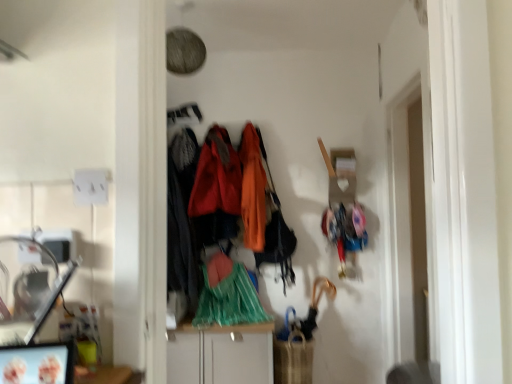
Question: Relative to white glossy cabinet at center, is velvet-like black coat at center, which appears as the first clothing when viewed from the left, in front or behind?

Choices:
 (A) behind
 (B) front

Answer: (A)

Question: Considering the relative positions of velvet-like black coat at center, which appears as the first clothing when viewed from the left, and white glossy cabinet at center in the image provided, is velvet-like black coat at center, which appears as the first clothing when viewed from the left, to the left or to the right of white glossy cabinet at center?

Choices:
 (A) right
 (B) left

Answer: (B)

Question: Which is farther from the orange fabric coat at center, acting as the first clothing starting from the right?

Choices:
 (A) velvet orange coat at center, which ranks as the 3th clothing in right-to-left order
 (B) white glossy cabinet at center
 (C) green plastic bag at center, the second clothing from the right
 (D) velvet-like black coat at center, which appears as the first clothing when viewed from the left

Answer: (B)

Question: Estimate the real-world distances between objects in this image. Which object is closer to the white glossy cabinet at center?

Choices:
 (A) velvet-like black coat at center, positioned as the fourth clothing in right-to-left order
 (B) velvet orange coat at center, which appears as the second clothing when viewed from the left
 (C) green plastic bag at center, which is the third clothing in left-to-right order
 (D) orange fabric coat at center, which appears as the fourth clothing when viewed from the left

Answer: (C)